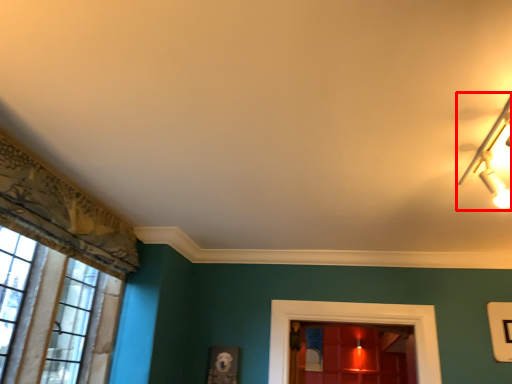
Question: In this image, where is lamp (annotated by the red box) located relative to window?

Choices:
 (A) left
 (B) right

Answer: (B)